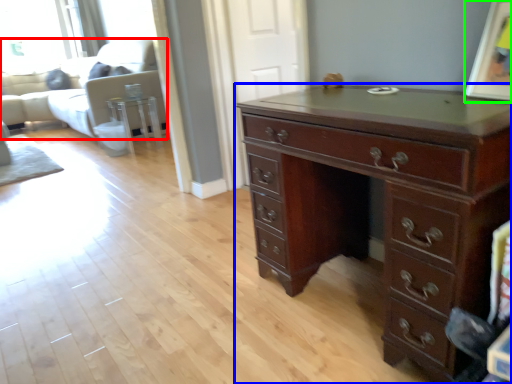
Question: Which object is positioned farthest from couch (highlighted by a red box)? Select from chest of drawers (highlighted by a blue box) and picture frame (highlighted by a green box).

Choices:
 (A) chest of drawers
 (B) picture frame

Answer: (B)